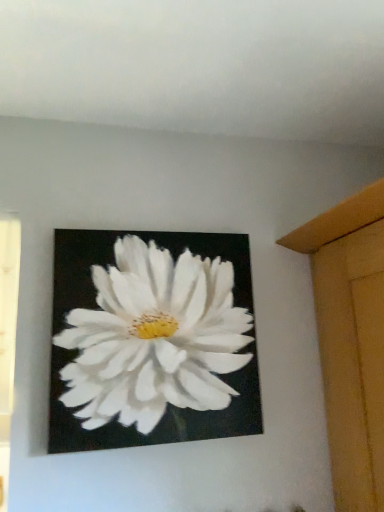
Image resolution: width=384 pixels, height=512 pixels. Describe the element at coordinates (153, 339) in the screenshot. I see `white matte flower at center` at that location.

What is the approximate height of white matte flower at center?

white matte flower at center is 51.36 centimeters in height.

Locate an element on the screen. This screenshot has width=384, height=512. white matte flower at center is located at coordinates (153, 339).

Measure the distance between point (x=194, y=346) and camera.

Point (x=194, y=346) and camera are 3.35 feet apart from each other.

Image resolution: width=384 pixels, height=512 pixels. Identify the location of white matte flower at center. (153, 339).